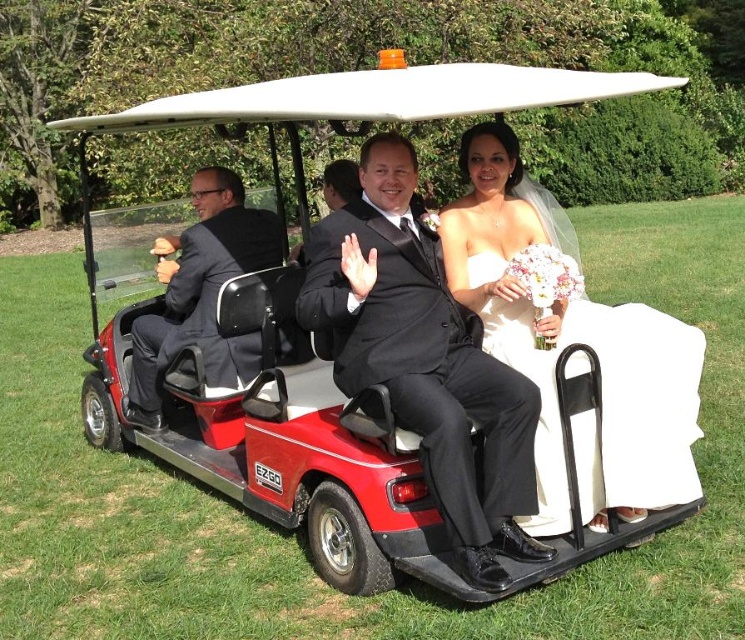
Is matte black suit at center positioned at the back of white satin dress at center?

No, it is in front of white satin dress at center.

Looking at this image, measure the distance between point (504, 524) and camera.

Point (504, 524) and camera are 3.33 meters apart.

Where is `matte black suit at center`? The image size is (745, 640). matte black suit at center is located at coordinates (425, 360).

Does point (340, 349) lie behind point (238, 179)?

No.

Locate an element on the screen. The width and height of the screenshot is (745, 640). matte black suit at center is located at coordinates (x=425, y=360).

Where is `white satin dress at center`? white satin dress at center is located at coordinates (568, 342).

Based on the photo, does white satin dress at center appear on the left side of matte black suit at left?

No, white satin dress at center is not to the left of matte black suit at left.

Which is behind, point (548, 396) or point (139, 408)?

The point (139, 408) is behind.

This screenshot has width=745, height=640. What are the coordinates of `white satin dress at center` in the screenshot? It's located at (568, 342).